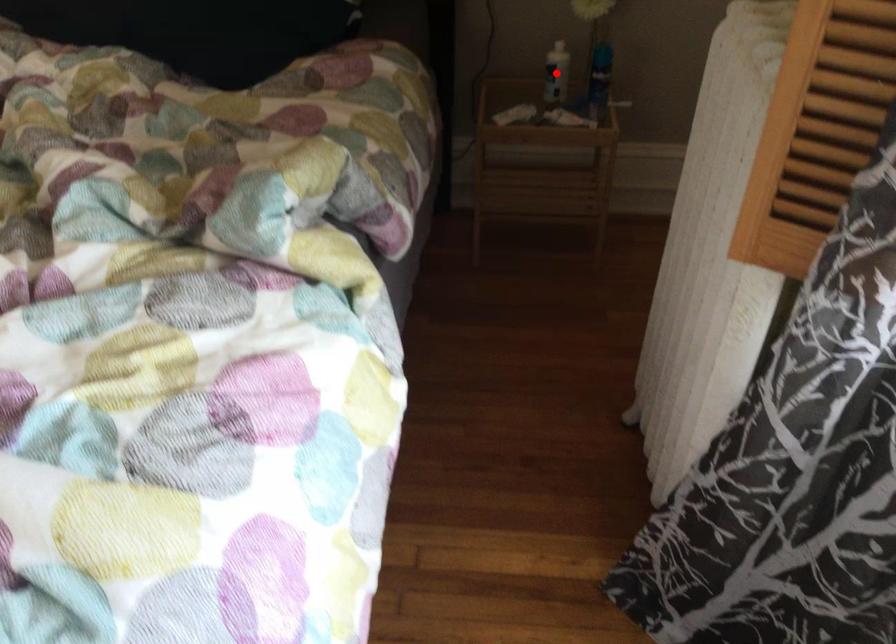
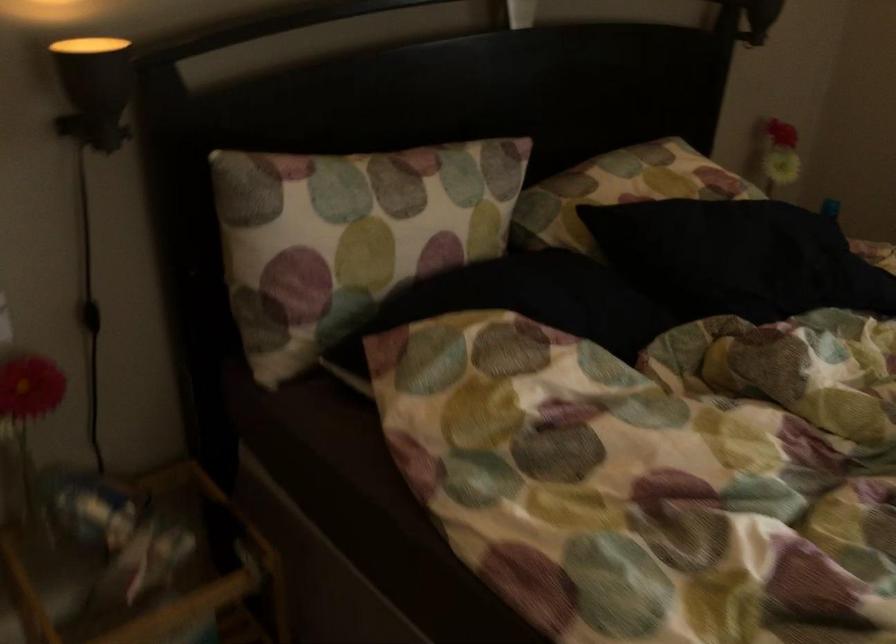
Question: I am providing you with two images of the same scene from different viewpoints. A red point is marked on the first image. Can you still see the location of the red point in image 2?

Choices:
 (A) Yes
 (B) No

Answer: (B)